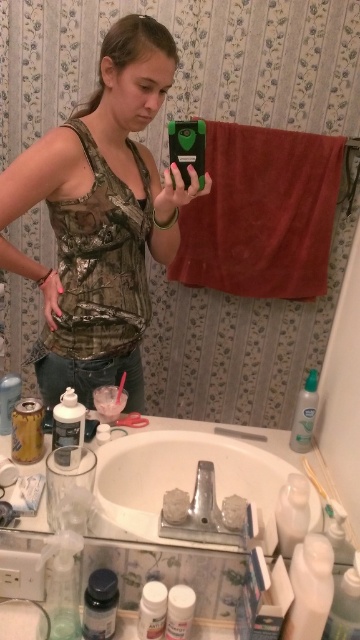
Does white ceramic sink at center have a lesser height compared to white plastic bottle at lower left?

No, white ceramic sink at center is not shorter than white plastic bottle at lower left.

Who is positioned more to the right, white ceramic sink at center or white plastic bottle at lower left?

white ceramic sink at center

Which is in front, point (263, 516) or point (57, 440)?

Positioned in front is point (263, 516).

I want to click on white ceramic sink at center, so click(181, 481).

Based on the photo, is translucent plastic bottle at lower left taller than white plastic bottle at lower center?

Yes.

Can you confirm if translucent plastic bottle at lower left is wider than white plastic bottle at lower center?

Yes.

Image resolution: width=360 pixels, height=640 pixels. Describe the element at coordinates (100, 604) in the screenshot. I see `translucent plastic bottle at lower left` at that location.

At what (x,y) coordinates should I click in order to perform the action: click on translucent plastic bottle at lower left. Please return your answer as a coordinate pair (x, y). This screenshot has width=360, height=640. Looking at the image, I should click on (100, 604).

Image resolution: width=360 pixels, height=640 pixels. I want to click on white ceramic sink at center, so click(x=181, y=481).

Can you confirm if white ceramic sink at center is wider than white plastic toothbrush at lower right?

Correct, the width of white ceramic sink at center exceeds that of white plastic toothbrush at lower right.

Find the location of a particular element. white ceramic sink at center is located at coordinates (181, 481).

You are a GUI agent. You are given a task and a screenshot of the screen. Output one action in this format:
    pyautogui.click(x=<x>, y=<y>)
    Task: Click on the white ceramic sink at center
    The image size is (360, 640).
    Given the screenshot: What is the action you would take?
    pyautogui.click(x=181, y=481)